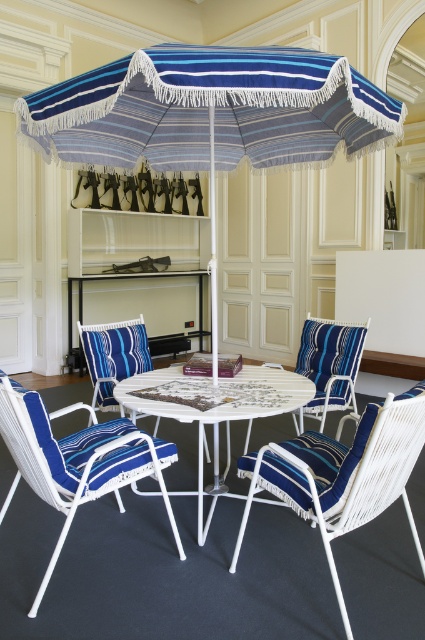
Question: Considering the real-world distances, which object is farthest from the blue striped fabric chair at center?

Choices:
 (A) blue striped cushioned chair at center
 (B) blue striped fabric chair at lower left

Answer: (B)

Question: Which of the following is the farthest from the observer?

Choices:
 (A) blue striped fabric umbrella at center
 (B) blue striped fabric armchair at center

Answer: (B)

Question: Observing the image, what is the correct spatial positioning of white wicker table at center in reference to blue striped fabric chair at center?

Choices:
 (A) above
 (B) below

Answer: (B)

Question: Can you confirm if blue striped fabric umbrella at center is smaller than blue striped fabric chair at center?

Choices:
 (A) yes
 (B) no

Answer: (B)

Question: Among these objects, which one is farthest from the camera?

Choices:
 (A) blue striped fabric armchair at center
 (B) blue striped fabric umbrella at center
 (C) blue striped fabric chair at lower left

Answer: (A)

Question: Can you confirm if blue striped fabric chair at lower left is positioned to the right of white wicker table at center?

Choices:
 (A) no
 (B) yes

Answer: (A)